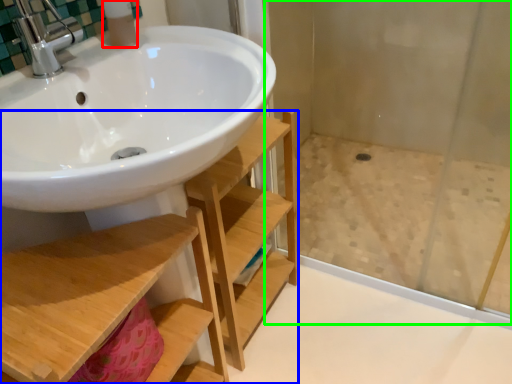
Question: Which object is positioned farthest from toiletry (highlighted by a red box)? Select from shelf (highlighted by a blue box) and shower door (highlighted by a green box).

Choices:
 (A) shelf
 (B) shower door

Answer: (B)